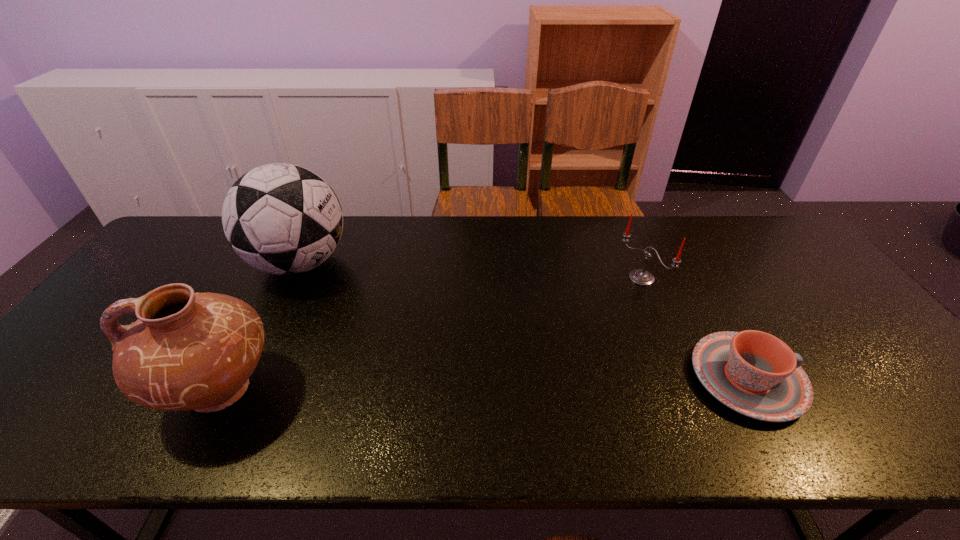
Where is `pottery`? The width and height of the screenshot is (960, 540). pottery is located at coordinates (187, 351).

The width and height of the screenshot is (960, 540). Identify the location of the shortest object. (756, 374).

Identify the location of soccer ball. (284, 219).

The height and width of the screenshot is (540, 960). Identify the location of the third tallest object. (642, 277).

The image size is (960, 540). Find the location of `free space located on the side of the pottery with the handle`. free space located on the side of the pottery with the handle is located at coordinates (68, 390).

This screenshot has width=960, height=540. What are the coordinates of `vacant space located on the side of the pottery with the handle` in the screenshot? It's located at (133, 390).

Locate an element on the screen. free space located on the side of the pottery with the handle is located at coordinates (133, 390).

Find the location of a particular element. Image resolution: width=960 pixels, height=540 pixels. vacant space positioned on the handle side of the chinaware is located at coordinates (848, 378).

Image resolution: width=960 pixels, height=540 pixels. Find the location of `vacant space located 0.190m on the surface of the soccer ball where the brand logo is visible`. vacant space located 0.190m on the surface of the soccer ball where the brand logo is visible is located at coordinates (368, 319).

You are a GUI agent. You are given a task and a screenshot of the screen. Output one action in this format:
    pyautogui.click(x=<x>, y=<y>)
    Task: Click on the vacant region located on the surface of the soccer ball where the brand logo is visible
    The height and width of the screenshot is (540, 960).
    Given the screenshot: What is the action you would take?
    pyautogui.click(x=361, y=313)